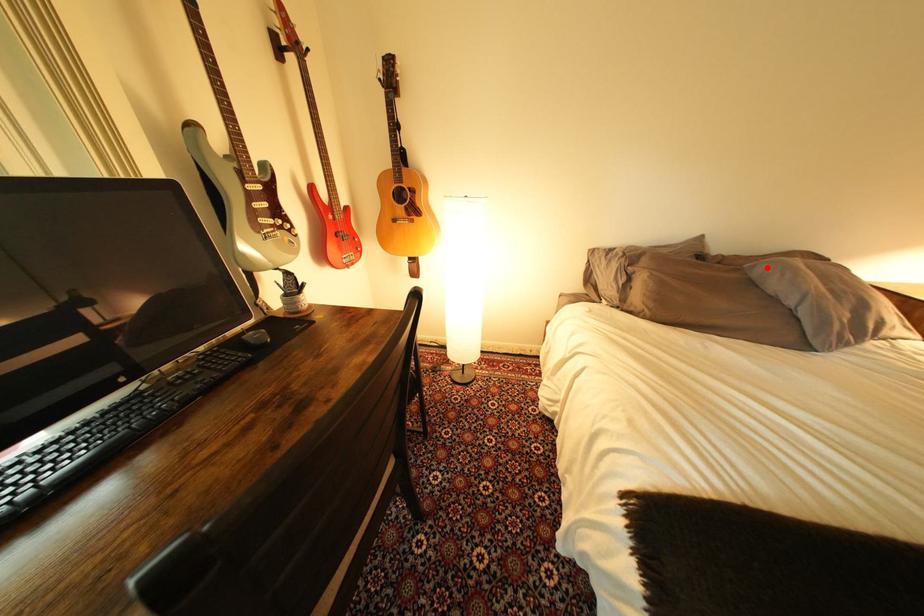
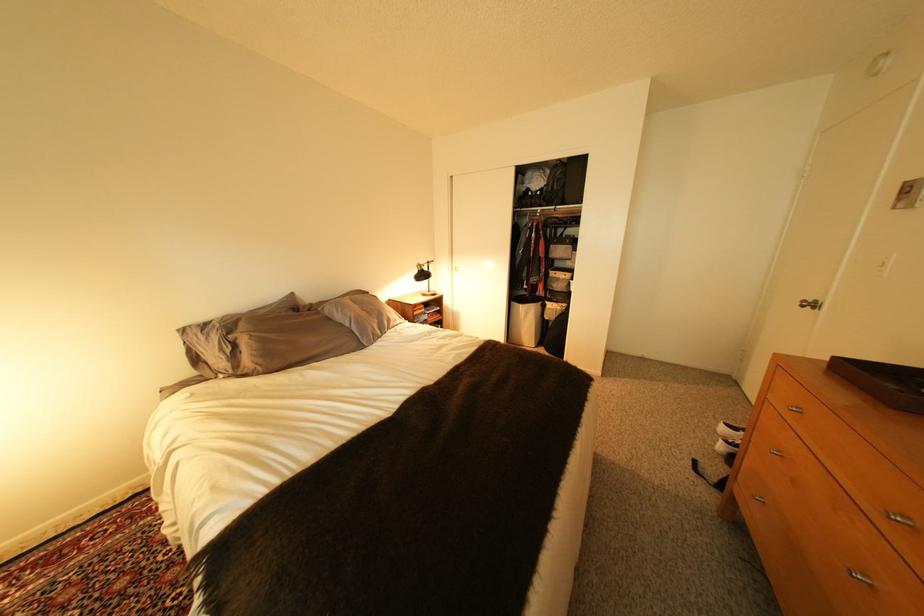
Question: I am providing you with two images of the same scene from different viewpoints. A red point is marked on the first image. Can you still see the location of the red point in image 2?

Choices:
 (A) Yes
 (B) No

Answer: (A)